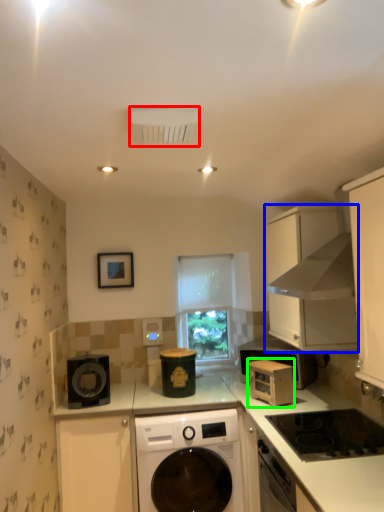
Question: Which object is the closest to the air conditioning (highlighted by a red box)? Choose among these: cabinetry (highlighted by a blue box) or microwave oven (highlighted by a green box).

Choices:
 (A) cabinetry
 (B) microwave oven

Answer: (A)